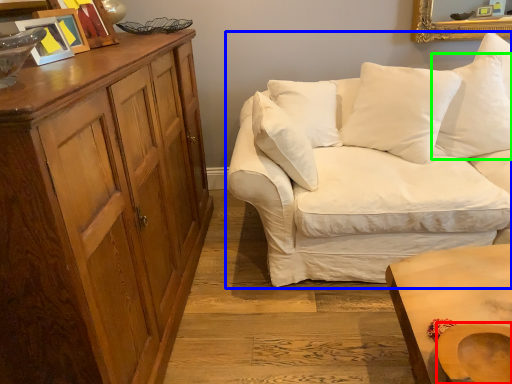
Question: Which is nearer to the swivel chair (highlighted by a red box)? studio couch (highlighted by a blue box) or pillow (highlighted by a green box).

Choices:
 (A) studio couch
 (B) pillow

Answer: (A)